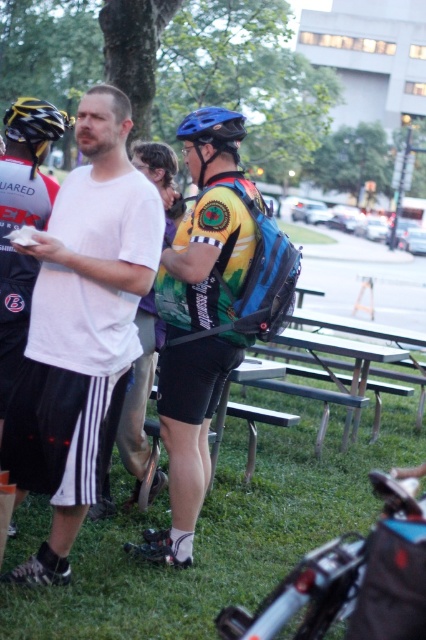
Which is more to the right, matte yellow jersey at center or blue matte bicycle helmet at upper center?

blue matte bicycle helmet at upper center

Can you confirm if matte yellow jersey at center is bigger than blue matte bicycle helmet at upper center?

Incorrect, matte yellow jersey at center is not larger than blue matte bicycle helmet at upper center.

I want to click on matte yellow jersey at center, so click(x=196, y=339).

Can you confirm if white matte t-shirt at left is thinner than yellow matte bicycle helmet at upper left?

Indeed, white matte t-shirt at left has a lesser width compared to yellow matte bicycle helmet at upper left.

Describe the element at coordinates (80, 328) in the screenshot. I see `white matte t-shirt at left` at that location.

Image resolution: width=426 pixels, height=640 pixels. Identify the location of white matte t-shirt at left. (80, 328).

Between white matte t-shirt at left and matte yellow jersey at center, which one has more height?

Standing taller between the two is white matte t-shirt at left.

The width and height of the screenshot is (426, 640). What do you see at coordinates (80, 328) in the screenshot?
I see `white matte t-shirt at left` at bounding box center [80, 328].

You are a GUI agent. You are given a task and a screenshot of the screen. Output one action in this format:
    pyautogui.click(x=<x>, y=<y>)
    Task: Click on the white matte t-shirt at left
    The height and width of the screenshot is (640, 426).
    Given the screenshot: What is the action you would take?
    pyautogui.click(x=80, y=328)